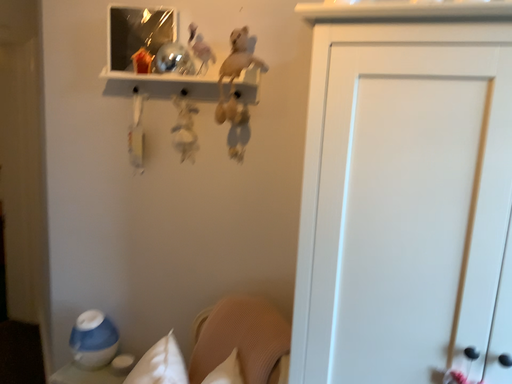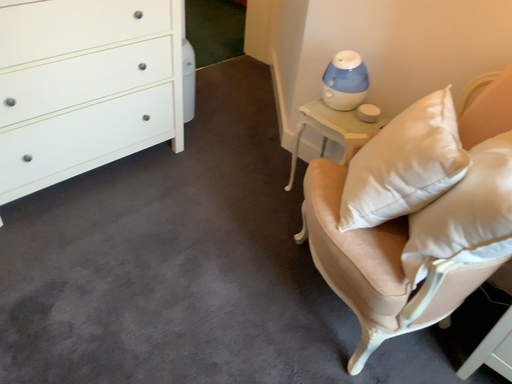
Question: Which way did the camera rotate in the video?

Choices:
 (A) rotated upward
 (B) rotated downward

Answer: (B)